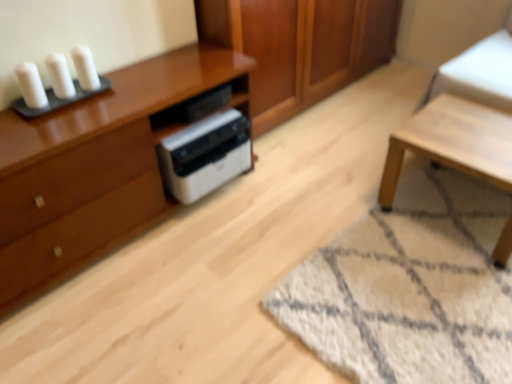
Locate an element on the screen. The height and width of the screenshot is (384, 512). free space on the front side of matte brown cabinet at left is located at coordinates (142, 311).